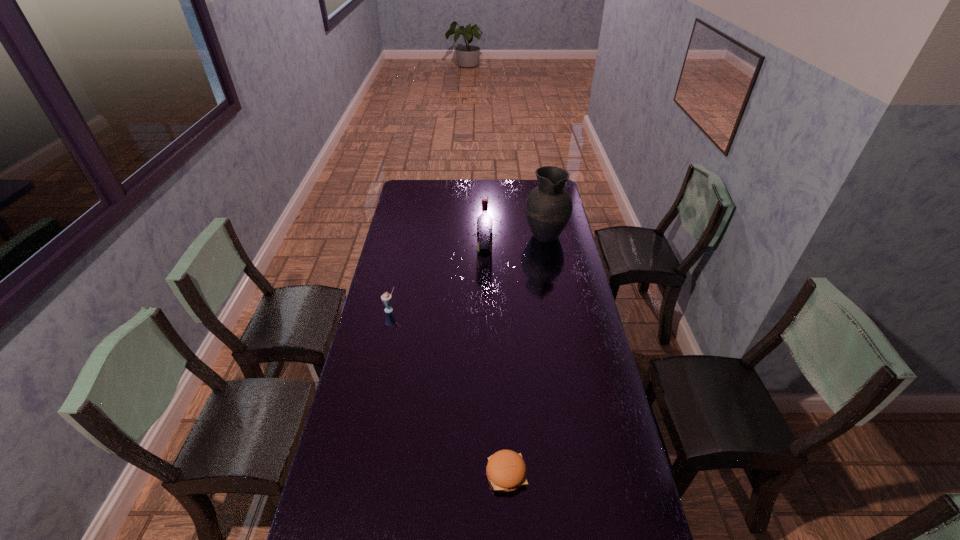
Where is `the rightmost object`? the rightmost object is located at coordinates (548, 207).

The image size is (960, 540). I want to click on pitcher, so click(x=548, y=207).

This screenshot has width=960, height=540. I want to click on the second tallest object, so click(x=484, y=222).

You are a GUI agent. You are given a task and a screenshot of the screen. Output one action in this format:
    pyautogui.click(x=<x>, y=<y>)
    Task: Click on the milkshake
    This screenshot has height=540, width=960.
    Given the screenshot: What is the action you would take?
    pyautogui.click(x=386, y=298)

The width and height of the screenshot is (960, 540). Identify the location of the second shortest object. (386, 298).

The height and width of the screenshot is (540, 960). What are the coordinates of `the nearest object` in the screenshot? It's located at (506, 471).

This screenshot has width=960, height=540. Identify the location of the shortest object. (506, 471).

You are a GUI agent. You are given a task and a screenshot of the screen. Output one action in this format:
    pyautogui.click(x=<x>, y=<y>)
    Task: Click on the free space located on the side of the rightmost object with the handle
    
    Given the screenshot: What is the action you would take?
    pyautogui.click(x=539, y=198)

The width and height of the screenshot is (960, 540). Identify the location of vacant region located on the side of the rightmost object with the handle. (541, 214).

The image size is (960, 540). What are the coordinates of `blank area located on the side of the rightmost object with the handle` in the screenshot? It's located at (539, 201).